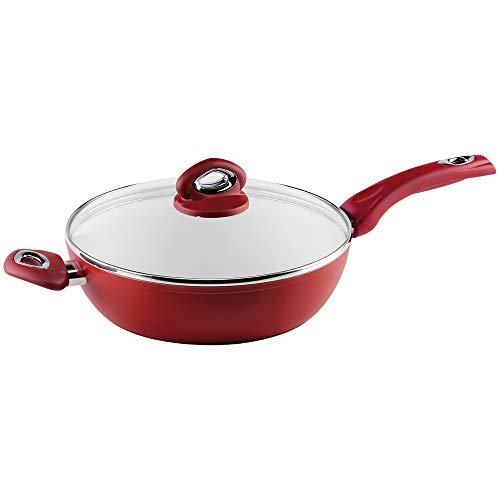
At what (x,y) coordinates should I click in order to perform the action: click on metal rim inside secondary pan handle. Please return your answer as a coordinate pair (x, y). This screenshot has height=500, width=500. Looking at the image, I should click on (44, 261).